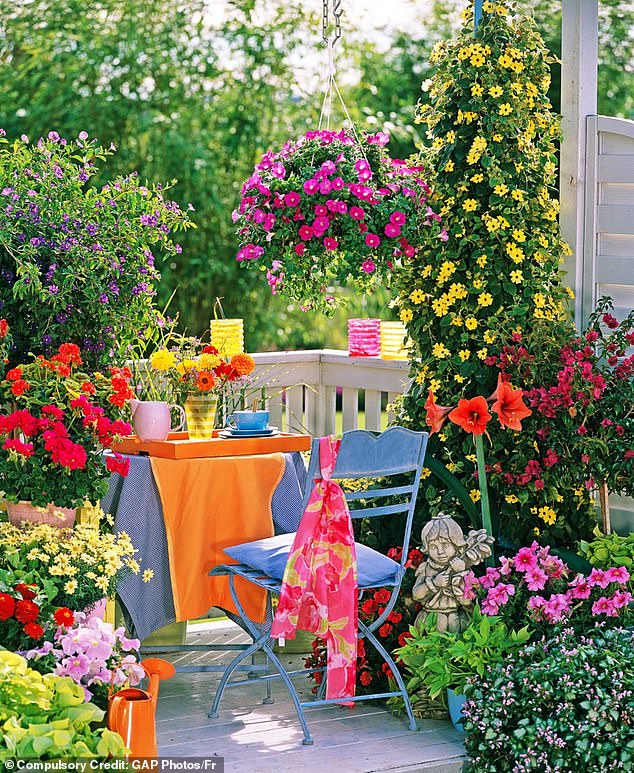
Image resolution: width=634 pixels, height=773 pixels. Find the location of `cushion`. cushion is located at coordinates (273, 550).